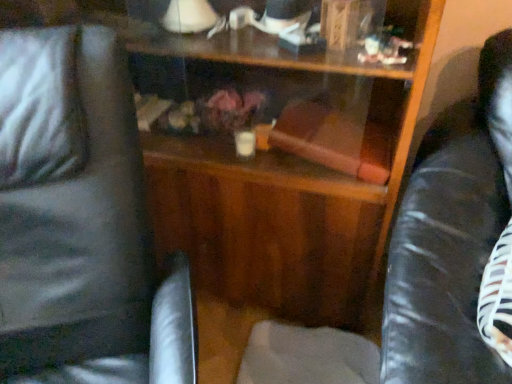
Question: From a real-world perspective, is black leather swivel chair at right, the 2th swivel chair when ordered from left to right, positioned over black leather swivel chair at left, marked as the 1th swivel chair in a left-to-right arrangement, based on gravity?

Choices:
 (A) no
 (B) yes

Answer: (B)

Question: Does black leather swivel chair at right, the 2th swivel chair when ordered from left to right, have a greater width compared to black leather swivel chair at left, marked as the 1th swivel chair in a left-to-right arrangement?

Choices:
 (A) yes
 (B) no

Answer: (B)

Question: Considering the relative sizes of black leather swivel chair at right, the first swivel chair viewed from the right, and black leather swivel chair at left, which is counted as the 2th swivel chair, starting from the right, in the image provided, is black leather swivel chair at right, the first swivel chair viewed from the right, shorter than black leather swivel chair at left, which is counted as the 2th swivel chair, starting from the right,?

Choices:
 (A) no
 (B) yes

Answer: (B)

Question: Is black leather swivel chair at right, the first swivel chair viewed from the right, turned away from black leather swivel chair at left, marked as the 1th swivel chair in a left-to-right arrangement?

Choices:
 (A) no
 (B) yes

Answer: (A)

Question: Does black leather swivel chair at right, the 2th swivel chair when ordered from left to right, come in front of black leather swivel chair at left, marked as the 1th swivel chair in a left-to-right arrangement?

Choices:
 (A) yes
 (B) no

Answer: (B)

Question: Considering the relative positions of black leather swivel chair at right, the 2th swivel chair when ordered from left to right, and black leather swivel chair at left, marked as the 1th swivel chair in a left-to-right arrangement, in the image provided, is black leather swivel chair at right, the 2th swivel chair when ordered from left to right, to the right of black leather swivel chair at left, marked as the 1th swivel chair in a left-to-right arrangement, from the viewer's perspective?

Choices:
 (A) yes
 (B) no

Answer: (A)

Question: Is black leather swivel chair at left, which is counted as the 2th swivel chair, starting from the right, oriented away from black leather swivel chair at right, the 2th swivel chair when ordered from left to right?

Choices:
 (A) no
 (B) yes

Answer: (A)

Question: Does black leather swivel chair at left, marked as the 1th swivel chair in a left-to-right arrangement, have a smaller size compared to black leather swivel chair at right, the first swivel chair viewed from the right?

Choices:
 (A) yes
 (B) no

Answer: (B)

Question: Considering the relative sizes of black leather swivel chair at left, which is counted as the 2th swivel chair, starting from the right, and black leather swivel chair at right, the 2th swivel chair when ordered from left to right, in the image provided, is black leather swivel chair at left, which is counted as the 2th swivel chair, starting from the right, shorter than black leather swivel chair at right, the 2th swivel chair when ordered from left to right,?

Choices:
 (A) yes
 (B) no

Answer: (B)

Question: Is black leather swivel chair at left, marked as the 1th swivel chair in a left-to-right arrangement, positioned behind black leather swivel chair at right, the 2th swivel chair when ordered from left to right?

Choices:
 (A) yes
 (B) no

Answer: (B)

Question: Does black leather swivel chair at left, which is counted as the 2th swivel chair, starting from the right, have a larger size compared to black leather swivel chair at right, the first swivel chair viewed from the right?

Choices:
 (A) yes
 (B) no

Answer: (A)

Question: Is black leather swivel chair at left, marked as the 1th swivel chair in a left-to-right arrangement, facing towards black leather swivel chair at right, the 2th swivel chair when ordered from left to right?

Choices:
 (A) no
 (B) yes

Answer: (A)

Question: Considering the positions of point (150, 314) and point (394, 307), is point (150, 314) closer or farther from the camera than point (394, 307)?

Choices:
 (A) farther
 (B) closer

Answer: (A)